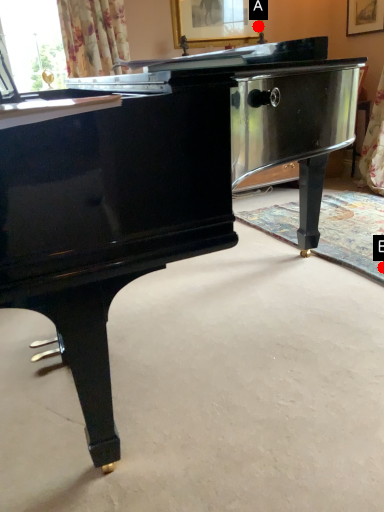
Question: Two points are circled on the image, labeled by A and B beside each circle. Which point is closer to the camera?

Choices:
 (A) A is closer
 (B) B is closer

Answer: (B)